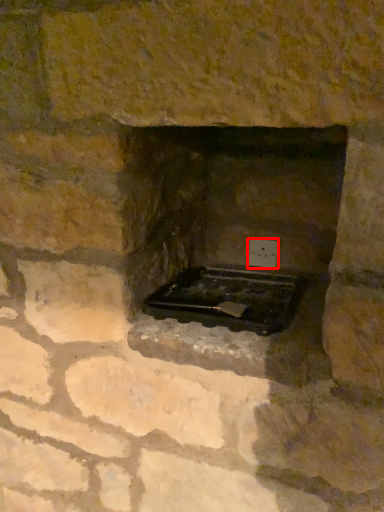
Question: From the image's perspective, where is electric outlet (annotated by the red box) located in relation to appliance in the image?

Choices:
 (A) below
 (B) above

Answer: (B)